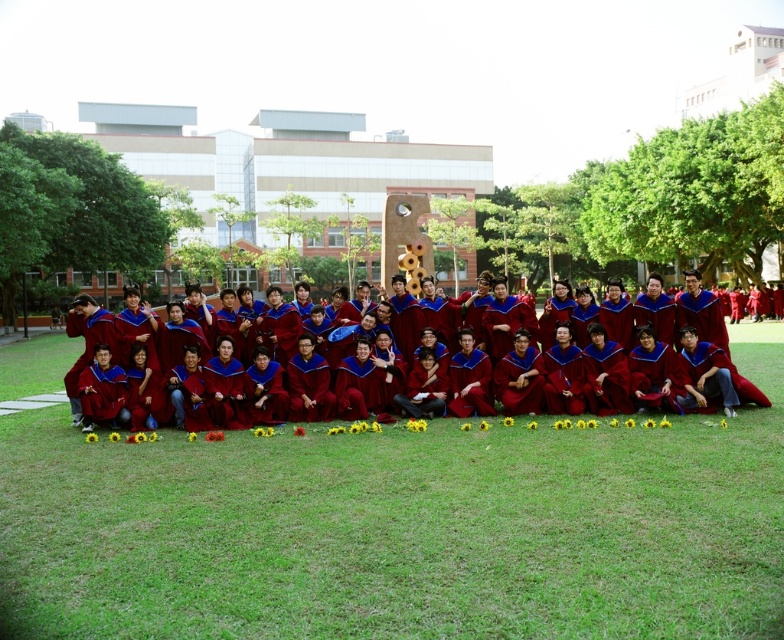
You are a photographer trying to capture a wide shot of the graduation ceremony. The green grass at center and maroon velvet graduation gowns at center are both in your frame. Based on their sizes in the image, which one appears wider?

The green grass at center appears wider than the maroon velvet graduation gowns at center because its width is larger in the image.